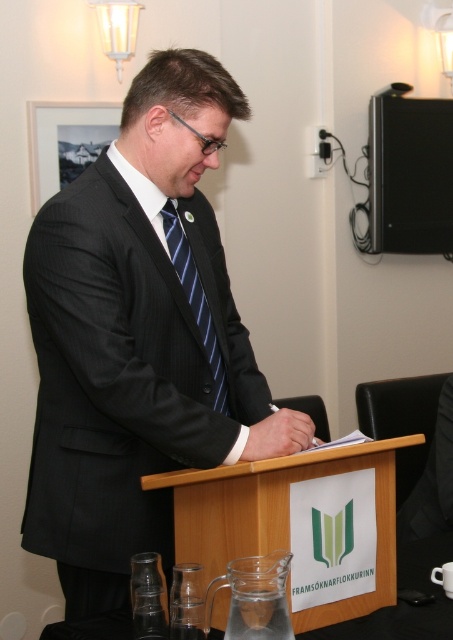
Question: Is black pinstripe suit at center wider than wooden podium at center?

Choices:
 (A) no
 (B) yes

Answer: (B)

Question: Which point is closer to the camera taking this photo?

Choices:
 (A) (192, 268)
 (B) (242, 474)

Answer: (B)

Question: Does black pinstripe suit at center have a larger size compared to wooden podium at center?

Choices:
 (A) yes
 (B) no

Answer: (A)

Question: Is black pinstripe suit at center to the left of wooden podium at center from the viewer's perspective?

Choices:
 (A) yes
 (B) no

Answer: (A)

Question: Which point is farther from the camera taking this photo?

Choices:
 (A) (176, 205)
 (B) (390, 564)

Answer: (A)

Question: Among these points, which one is nearest to the camera?

Choices:
 (A) (95, 244)
 (B) (186, 278)

Answer: (A)